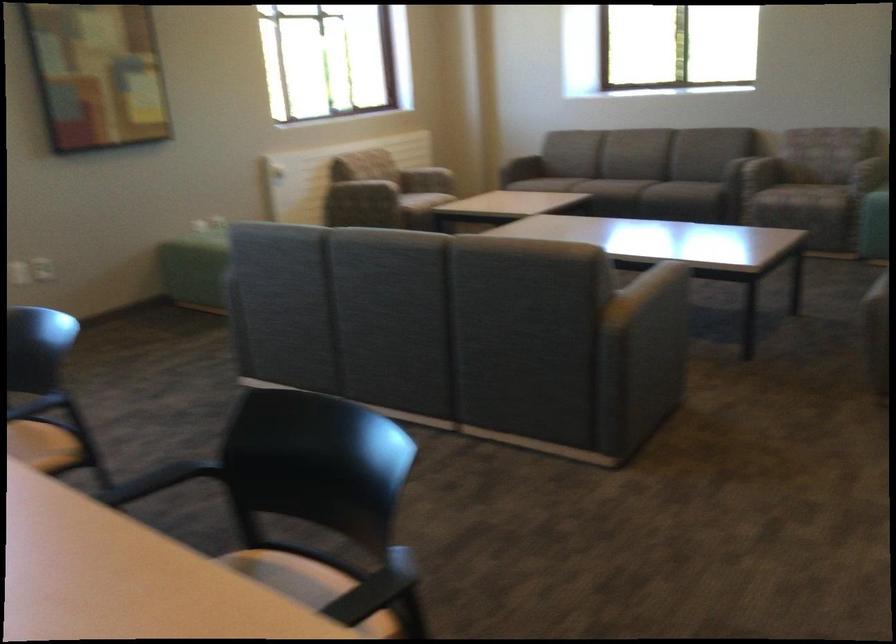
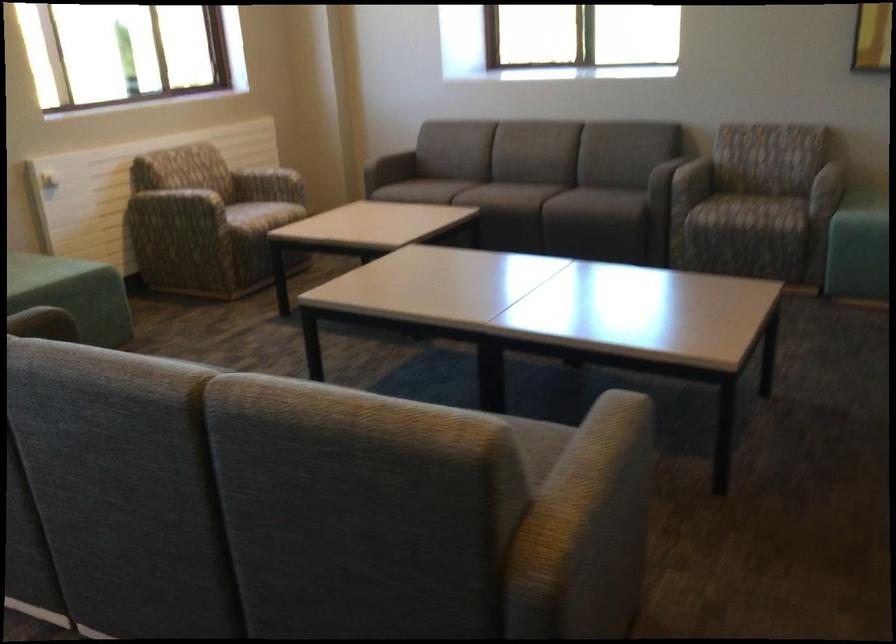
Locate, in the second image, the point that corresponds to (365,181) in the first image.

(179, 204)